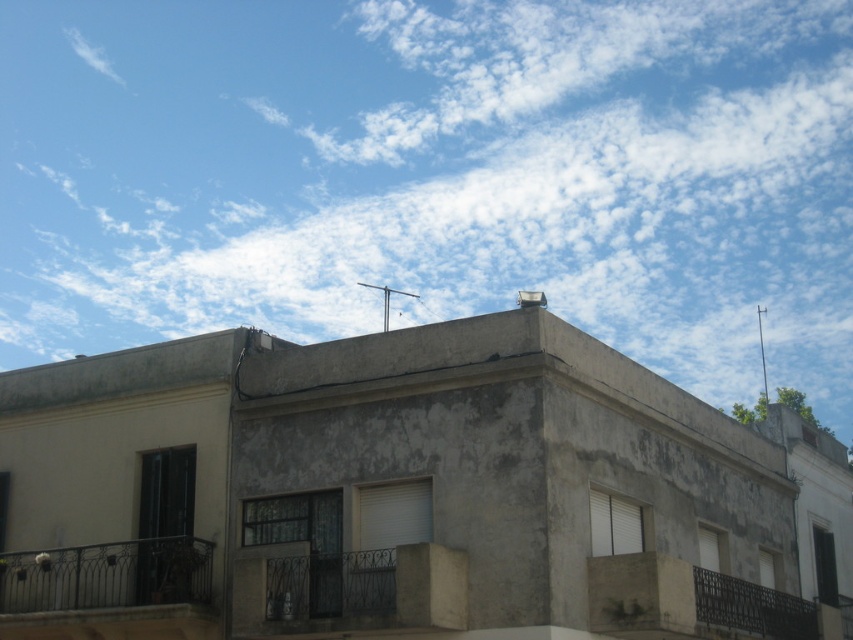
You are a painter who needs to choose between two balconies to paint. The dark gray metal balcony at center and the black wrought iron balcony at lower right. Which balcony requires less paint because of its size?

The dark gray metal balcony at center requires less paint because it is smaller in size compared to the black wrought iron balcony at lower right.

You are standing on the ground floor of the building and want to hang a large banner between the dark gray metal balcony at center and the black wrought iron balcony at lower right. Which balcony is shorter and thus more suitable for hanging the banner at a lower height?

The dark gray metal balcony at center has a lesser height compared to the black wrought iron balcony at lower right, so it is more suitable for hanging the banner at a lower height.

You are standing in front of the residential building. You see the dark gray metal balcony at center and the black wrought iron balcony at lower right. Which one is positioned to the left side of the other?

The dark gray metal balcony at center is positioned to the left of the black wrought iron balcony at lower right.